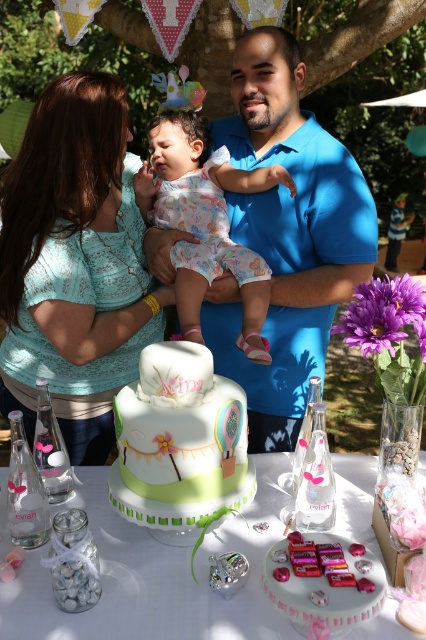
Question: Is matte teal blouse at upper left bigger than white frosted cake at center?

Choices:
 (A) yes
 (B) no

Answer: (A)

Question: Which object is closer to the camera taking this photo?

Choices:
 (A) blue cotton shirt at center
 (B) white frosted cake at center
 (C) white fondant cake at center
 (D) matte teal blouse at upper left

Answer: (B)

Question: Which point is farther to the camera?

Choices:
 (A) matte teal blouse at upper left
 (B) blue cotton shirt at center

Answer: (B)

Question: Is pastel floral onesie at center wider than shiny pink cake at center?

Choices:
 (A) no
 (B) yes

Answer: (B)

Question: Is matte teal blouse at upper left to the right of blue cotton shirt at center from the viewer's perspective?

Choices:
 (A) yes
 (B) no

Answer: (B)

Question: Which point is closer to the camera?

Choices:
 (A) white frosted cake at center
 (B) blue cotton shirt at center

Answer: (A)